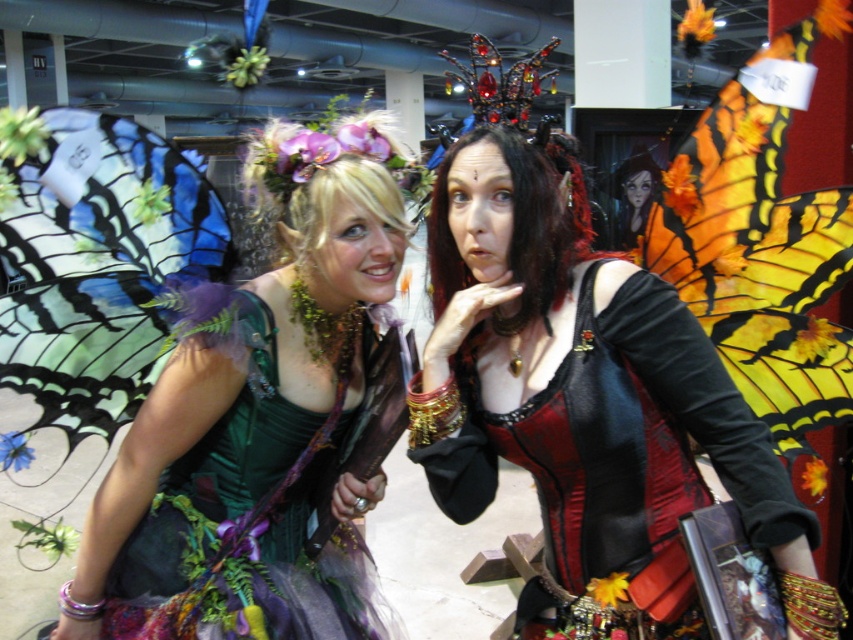
Question: Which point is closer to the camera?

Choices:
 (A) (103, 140)
 (B) (329, 468)

Answer: (A)

Question: Is green velvet dress at left above orange/yellow fabric wings at right?

Choices:
 (A) yes
 (B) no

Answer: (B)

Question: Where is matte black corset at center located in relation to orange/yellow fabric wings at right in the image?

Choices:
 (A) below
 (B) above

Answer: (A)

Question: Which of the following is the farthest from the observer?

Choices:
 (A) (627, 308)
 (B) (106, 140)
 (C) (735, 227)

Answer: (C)

Question: Which object appears closest to the camera in this image?

Choices:
 (A) green velvet dress at left
 (B) orange/yellow fabric wings at right

Answer: (A)

Question: Does green velvet dress at left lie behind orange/yellow fabric wings at right?

Choices:
 (A) yes
 (B) no

Answer: (B)